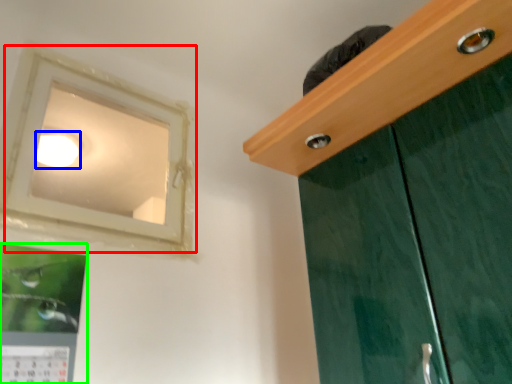
Question: Considering the real-world distances, which object is closest to window (highlighted by a red box)? lighting (highlighted by a blue box) or picture frame (highlighted by a green box).

Choices:
 (A) lighting
 (B) picture frame

Answer: (A)